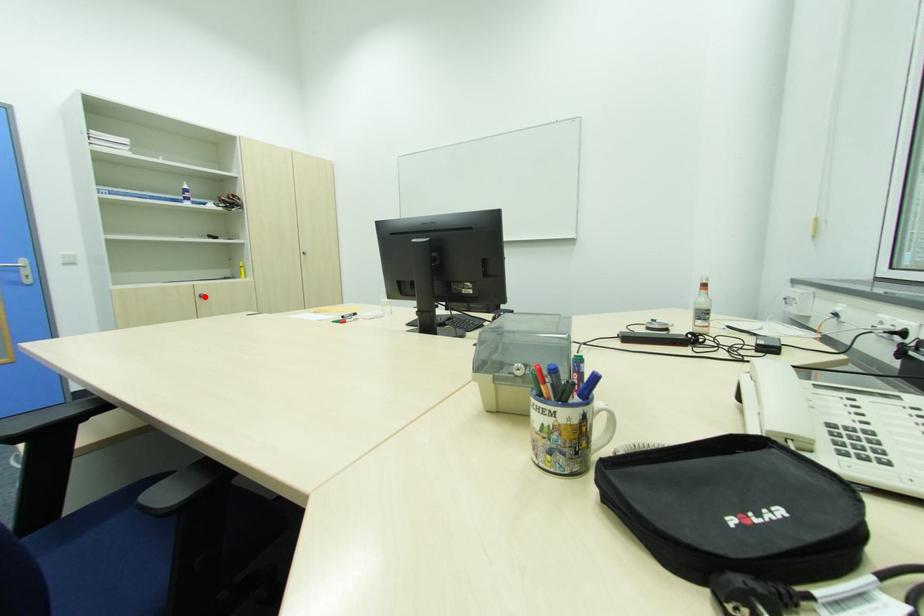
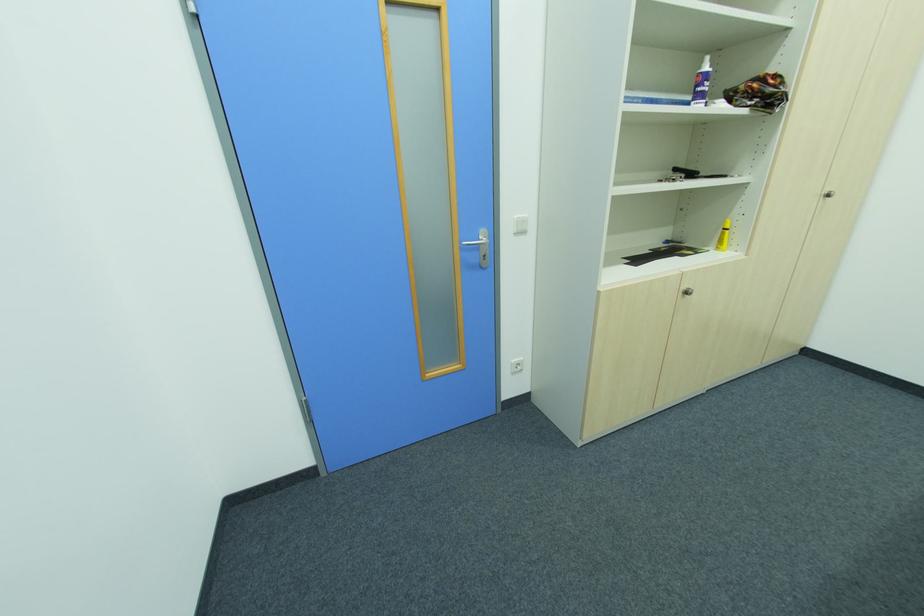
Find the pixel in the second image that matches the highlighted location in the first image.

(689, 294)